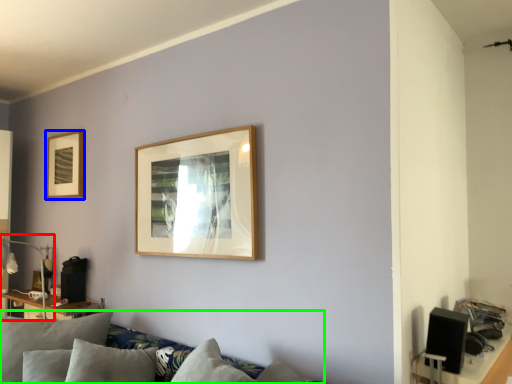
Question: Based on their relative distances, which object is nearer to lamp (highlighted by a red box)? Choose from picture frame (highlighted by a blue box) and couch (highlighted by a green box).

Choices:
 (A) picture frame
 (B) couch

Answer: (A)